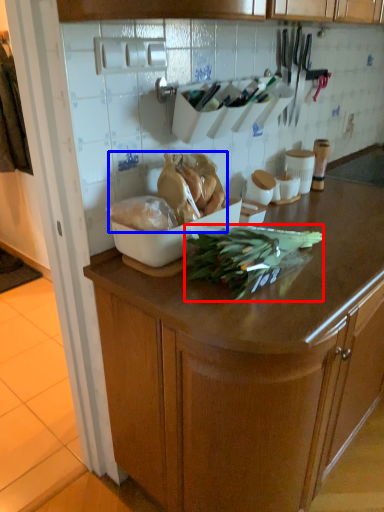
Question: Which of the following is the farthest to the observer, green vegetables (highlighted by a red box) or food (highlighted by a blue box)?

Choices:
 (A) green vegetables
 (B) food

Answer: (B)